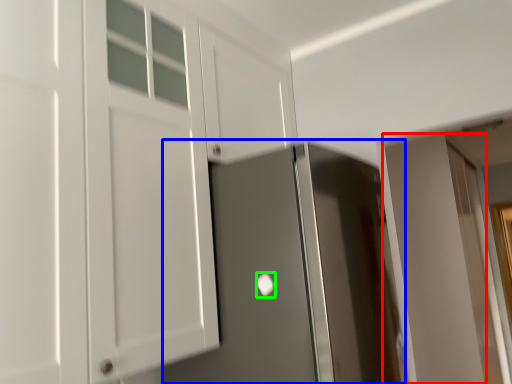
Question: Which object is positioned closest to door (highlighted by a red box)? Select from door (highlighted by a blue box) and door handle (highlighted by a green box).

Choices:
 (A) door
 (B) door handle

Answer: (A)